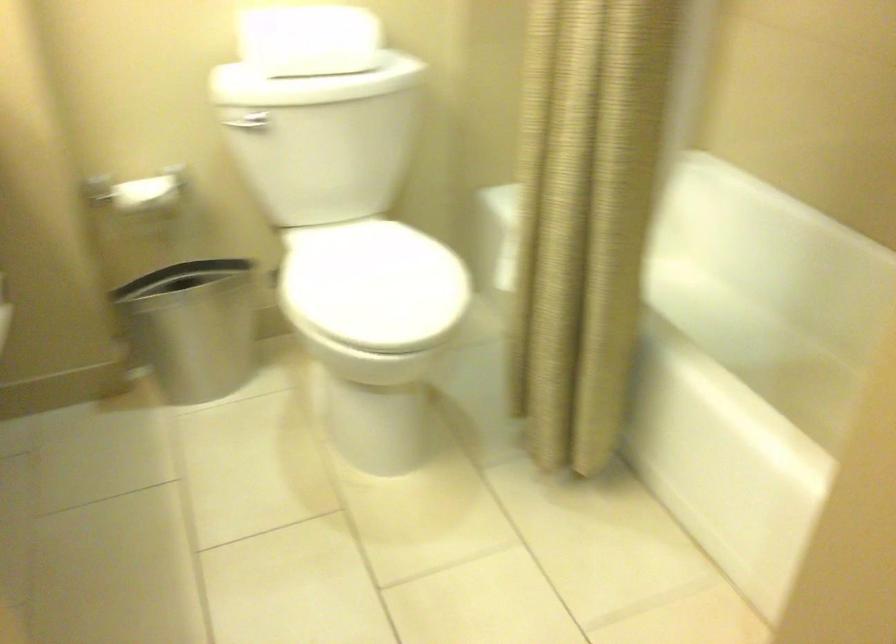
This screenshot has width=896, height=644. Find the location of `metal trash can`. metal trash can is located at coordinates (x=194, y=327).